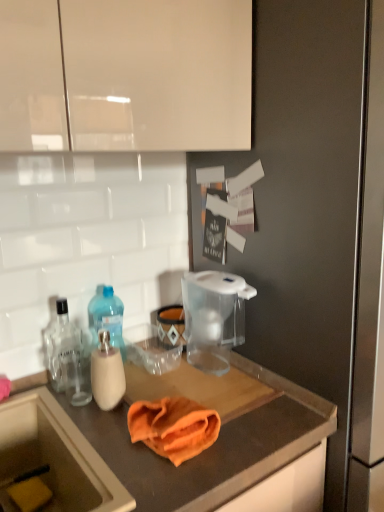
Locate an element on the screen. Image resolution: width=384 pixels, height=512 pixels. space that is in front of clear glass bottle at left, which is the 2th bottle from right to left is located at coordinates (61, 411).